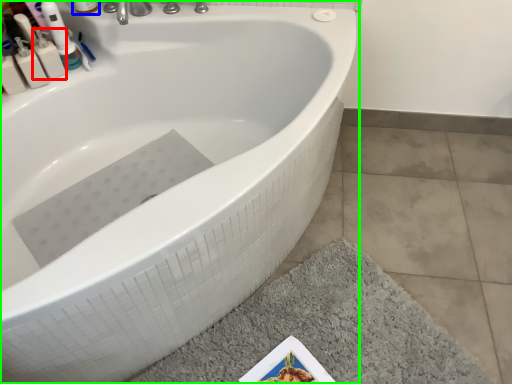
Question: Which object is the closest to the mouthwash (highlighted by a red box)? Choose among these: mouthwash (highlighted by a blue box) or bathtub (highlighted by a green box).

Choices:
 (A) mouthwash
 (B) bathtub

Answer: (A)